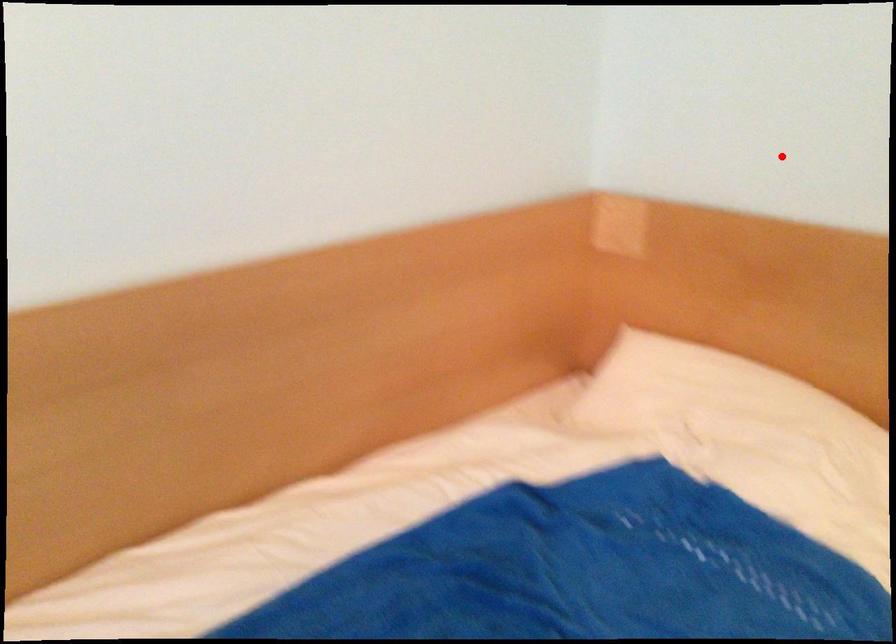
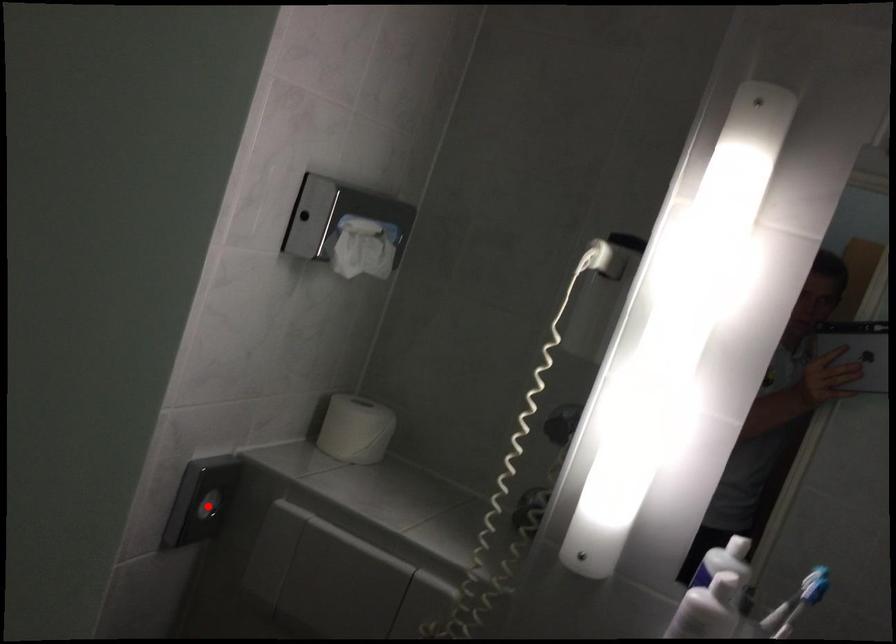
I am providing you with two images of the same scene from different viewpoints. A red point is marked on the first image and another point is marked on the second image. Is the red point in image1 aligned with the point shown in image2?

Yes